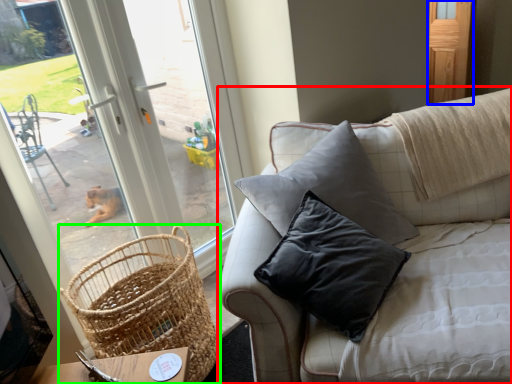
Question: Considering the real-world distances, which object is closest to studio couch (highlighted by a red box)? screen door (highlighted by a blue box) or picnic basket (highlighted by a green box).

Choices:
 (A) screen door
 (B) picnic basket

Answer: (B)